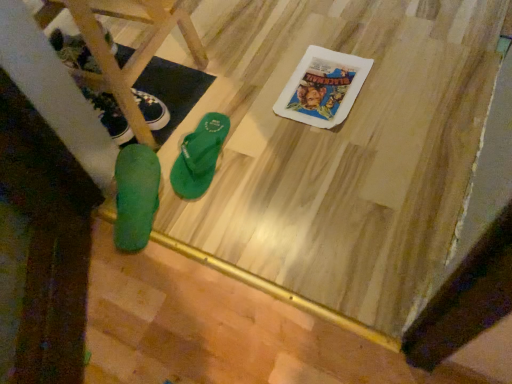
What do you see at coordinates (199, 157) in the screenshot? I see `green rubber flip-flop at center, which appears as the 1th footwear when viewed from the right` at bounding box center [199, 157].

I want to click on green rubber flip-flop at center, the third footwear positioned from the left, so click(199, 157).

Identify the location of green rubber flip-flop at center, the third footwear positioned from the left. This screenshot has width=512, height=384. (199, 157).

Is matte black sneaker at left, marked as the third footwear in a right-to-left arrangement, taller or shorter than green rubber flip-flop at center, which appears as the 1th footwear when viewed from the right?

matte black sneaker at left, marked as the third footwear in a right-to-left arrangement, is taller than green rubber flip-flop at center, which appears as the 1th footwear when viewed from the right.

Does matte black sneaker at left, the 1th footwear when ordered from left to right, touch green rubber flip-flop at center, the third footwear positioned from the left?

No, matte black sneaker at left, the 1th footwear when ordered from left to right, is not next to green rubber flip-flop at center, the third footwear positioned from the left.

Considering the relative sizes of matte black sneaker at left, marked as the third footwear in a right-to-left arrangement, and green rubber flip-flop at center, the third footwear positioned from the left, in the image provided, is matte black sneaker at left, marked as the third footwear in a right-to-left arrangement, bigger than green rubber flip-flop at center, the third footwear positioned from the left,?

No.

How many degrees apart are the facing directions of matte black sneaker at left, marked as the third footwear in a right-to-left arrangement, and green rubber flip-flop at center, the third footwear positioned from the left?

matte black sneaker at left, marked as the third footwear in a right-to-left arrangement, and green rubber flip-flop at center, the third footwear positioned from the left, are facing 24.9 degrees away from each other.

Between green rubber flip-flop at lower left, acting as the 2th footwear starting from the right, and matte black sneaker at left, the 1th footwear when ordered from left to right, which one has larger width?

With larger width is green rubber flip-flop at lower left, acting as the 2th footwear starting from the right.

From the image's perspective, which object appears higher, green rubber flip-flop at lower left, acting as the 2th footwear starting from the right, or matte black sneaker at left, the 1th footwear when ordered from left to right?

From the image's view, matte black sneaker at left, the 1th footwear when ordered from left to right, is above.

Is green rubber flip-flop at lower left, acting as the 2th footwear starting from the right, touching matte black sneaker at left, marked as the third footwear in a right-to-left arrangement?

green rubber flip-flop at lower left, acting as the 2th footwear starting from the right, and matte black sneaker at left, marked as the third footwear in a right-to-left arrangement, are clearly separated.

From the picture: Is green rubber flip-flop at center, the third footwear positioned from the left, facing towards green rubber flip-flop at lower left, which is the 2th footwear from left to right?

No.

From a real-world perspective, is green rubber flip-flop at center, the third footwear positioned from the left, on green rubber flip-flop at lower left, acting as the 2th footwear starting from the right?

No, from a real-world perspective, green rubber flip-flop at center, the third footwear positioned from the left, is not over green rubber flip-flop at lower left, acting as the 2th footwear starting from the right

Considering the sizes of green rubber flip-flop at center, the third footwear positioned from the left, and green rubber flip-flop at lower left, acting as the 2th footwear starting from the right, in the image, is green rubber flip-flop at center, the third footwear positioned from the left, taller or shorter than green rubber flip-flop at lower left, acting as the 2th footwear starting from the right,?

green rubber flip-flop at center, the third footwear positioned from the left, is shorter than green rubber flip-flop at lower left, acting as the 2th footwear starting from the right.

Which object is positioned more to the left, green rubber flip-flop at center, the third footwear positioned from the left, or green rubber flip-flop at lower left, which is the 2th footwear from left to right?

green rubber flip-flop at lower left, which is the 2th footwear from left to right.

From the image's perspective, would you say green rubber flip-flop at center, which appears as the 1th footwear when viewed from the right, is shown under green rubber flip-flops at lower left?

Indeed, from the image's perspective, green rubber flip-flop at center, which appears as the 1th footwear when viewed from the right, is shown beneath green rubber flip-flops at lower left.

Could you tell me if green rubber flip-flop at center, the third footwear positioned from the left, is turned towards green rubber flip-flops at lower left?

No.

Can you confirm if green rubber flip-flop at center, the third footwear positioned from the left, is wider than green rubber flip-flops at lower left?

No, green rubber flip-flop at center, the third footwear positioned from the left, is not wider than green rubber flip-flops at lower left.

From a real-world perspective, is green rubber flip-flop at center, which appears as the 1th footwear when viewed from the right, beneath green rubber flip-flops at lower left?

Indeed, from a real-world perspective, green rubber flip-flop at center, which appears as the 1th footwear when viewed from the right, is positioned beneath green rubber flip-flops at lower left.

From the image's perspective, between matte black sneaker at left, the 1th footwear when ordered from left to right, and green rubber flip-flop at lower left, which is the 2th footwear from left to right, who is located below?

green rubber flip-flop at lower left, which is the 2th footwear from left to right.

Is matte black sneaker at left, the 1th footwear when ordered from left to right, placed right next to green rubber flip-flop at lower left, which is the 2th footwear from left to right?

matte black sneaker at left, the 1th footwear when ordered from left to right, and green rubber flip-flop at lower left, which is the 2th footwear from left to right, are clearly separated.

Which object is wider, matte black sneaker at left, marked as the third footwear in a right-to-left arrangement, or green rubber flip-flop at lower left, acting as the 2th footwear starting from the right?

green rubber flip-flop at lower left, acting as the 2th footwear starting from the right.

Between matte black sneaker at left, the 1th footwear when ordered from left to right, and green rubber flip-flop at lower left, which is the 2th footwear from left to right, which one has less height?

Standing shorter between the two is matte black sneaker at left, the 1th footwear when ordered from left to right.

From a real-world perspective, is green rubber flip-flop at center, the third footwear positioned from the left, above or below matte black sneaker at left, the 1th footwear when ordered from left to right?

Clearly, from a real-world perspective, green rubber flip-flop at center, the third footwear positioned from the left, is below matte black sneaker at left, the 1th footwear when ordered from left to right.

Based on their positions, is green rubber flip-flop at center, which appears as the 1th footwear when viewed from the right, located to the left or right of matte black sneaker at left, the 1th footwear when ordered from left to right?

Based on their positions, green rubber flip-flop at center, which appears as the 1th footwear when viewed from the right, is located to the right of matte black sneaker at left, the 1th footwear when ordered from left to right.

Is matte black sneaker at left, marked as the third footwear in a right-to-left arrangement, surrounded by green rubber flip-flop at center, the third footwear positioned from the left?

No, matte black sneaker at left, marked as the third footwear in a right-to-left arrangement, is not surrounded by green rubber flip-flop at center, the third footwear positioned from the left.

Which is closer, [150,122] or [198,62]?

Point [150,122]

From a real-world perspective, is matte black sneaker at left, the 1th footwear when ordered from left to right, positioned above or below green rubber flip-flops at lower left?

From a real-world perspective, matte black sneaker at left, the 1th footwear when ordered from left to right, is physically below green rubber flip-flops at lower left.

In terms of width, does matte black sneaker at left, the 1th footwear when ordered from left to right, look wider or thinner when compared to green rubber flip-flops at lower left?

Considering their sizes, matte black sneaker at left, the 1th footwear when ordered from left to right, looks slimmer than green rubber flip-flops at lower left.

Can you see matte black sneaker at left, the 1th footwear when ordered from left to right, touching green rubber flip-flops at lower left?

They are not placed beside each other.

The image size is (512, 384). There is a green rubber flip-flop at center, which appears as the 1th footwear when viewed from the right. Find the location of `the 1st footwear above it (from a real-world perspective)`. the 1st footwear above it (from a real-world perspective) is located at coordinates (111, 117).

The image size is (512, 384). I want to click on the 2nd footwear in front of the matte black sneaker at left, marked as the third footwear in a right-to-left arrangement, counting from the anchor's position, so click(135, 196).

Considering their positions, is green rubber flip-flop at lower left, which is the 2th footwear from left to right, positioned closer to green rubber flip-flop at center, the third footwear positioned from the left, than green rubber flip-flops at lower left?

The object closer to green rubber flip-flop at center, the third footwear positioned from the left, is green rubber flip-flop at lower left, which is the 2th footwear from left to right.

Based on the photo, based on their spatial positions, is green rubber flip-flops at lower left or matte black sneaker at left, marked as the third footwear in a right-to-left arrangement, further from green rubber flip-flop at center, the third footwear positioned from the left?

The object further to green rubber flip-flop at center, the third footwear positioned from the left, is green rubber flip-flops at lower left.

Estimate the real-world distances between objects in this image. Which object is further from green rubber flip-flop at center, which appears as the 1th footwear when viewed from the right, matte black sneaker at left, marked as the third footwear in a right-to-left arrangement, or green rubber flip-flops at lower left?

green rubber flip-flops at lower left is further to green rubber flip-flop at center, which appears as the 1th footwear when viewed from the right.

From the image, which object appears to be farther from green rubber flip-flop at lower left, which is the 2th footwear from left to right, green rubber flip-flop at center, the third footwear positioned from the left, or green rubber flip-flops at lower left?

Among the two, green rubber flip-flops at lower left is located further to green rubber flip-flop at lower left, which is the 2th footwear from left to right.

From the image, which object appears to be nearer to green rubber flip-flops at lower left, green rubber flip-flop at lower left, which is the 2th footwear from left to right, or matte black sneaker at left, marked as the third footwear in a right-to-left arrangement?

Based on the image, matte black sneaker at left, marked as the third footwear in a right-to-left arrangement, appears to be nearer to green rubber flip-flops at lower left.

Looking at the image, which one is located closer to green rubber flip-flop at lower left, which is the 2th footwear from left to right, green rubber flip-flops at lower left or green rubber flip-flop at center, the third footwear positioned from the left?

Based on the image, green rubber flip-flop at center, the third footwear positioned from the left, appears to be nearer to green rubber flip-flop at lower left, which is the 2th footwear from left to right.

Based on the photo, considering their positions, is green rubber flip-flops at lower left positioned further to matte black sneaker at left, marked as the third footwear in a right-to-left arrangement, than green rubber flip-flop at lower left, which is the 2th footwear from left to right?

green rubber flip-flop at lower left, which is the 2th footwear from left to right, is further to matte black sneaker at left, marked as the third footwear in a right-to-left arrangement.

Considering their positions, is green rubber flip-flop at lower left, which is the 2th footwear from left to right, positioned further to matte black sneaker at left, the 1th footwear when ordered from left to right, than green rubber flip-flops at lower left?

Among the two, green rubber flip-flop at lower left, which is the 2th footwear from left to right, is located further to matte black sneaker at left, the 1th footwear when ordered from left to right.

This screenshot has width=512, height=384. In order to click on footwear between matte black sneaker at left, the 1th footwear when ordered from left to right, and green rubber flip-flop at lower left, acting as the 2th footwear starting from the right, in the vertical direction in this screenshot , I will do `click(199, 157)`.